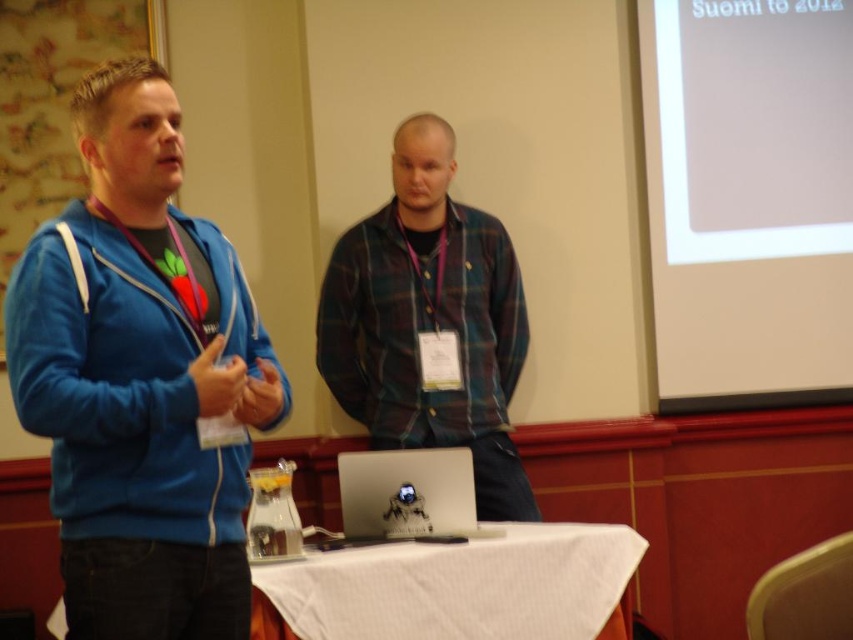
You are standing in a conference room and need to reach a point that is 3.45 meters away from the camera. The coordinates of this point are given as point (784, 388). Can you estimate whether this point is closer to the person on the left or the person on the right?

The point (784, 388) is 3.45 meters away from the camera. Without additional information about the positions of the two individuals relative to the camera, it is impossible to determine which person is closer to this point.

You are organizing a presentation and need to place the blue fleece jacket at left and the silver metallic laptop at center on a table. Which object should be placed higher to match the image?

The blue fleece jacket at left should be placed higher than the silver metallic laptop at center to match the image.